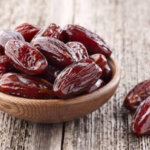
Locate an element on the screen. The width and height of the screenshot is (150, 150). brown bowl is located at coordinates (91, 102).